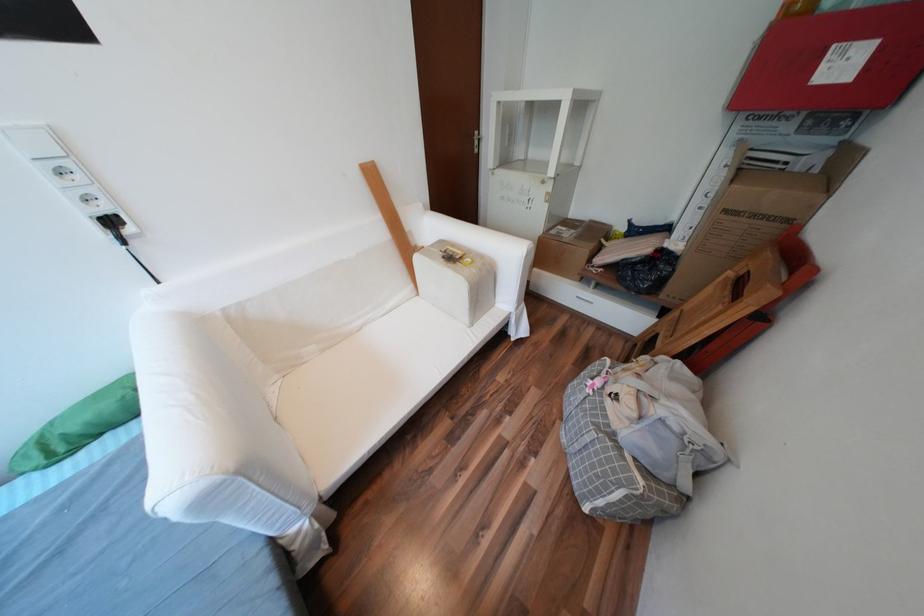
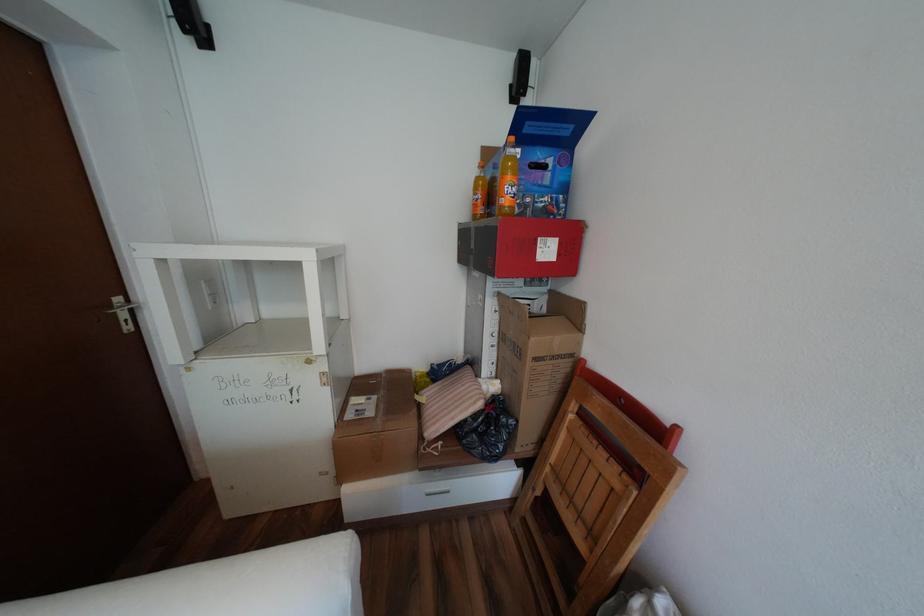
In the second image, find the point that corresponds to [485,132] in the first image.

(128, 299)